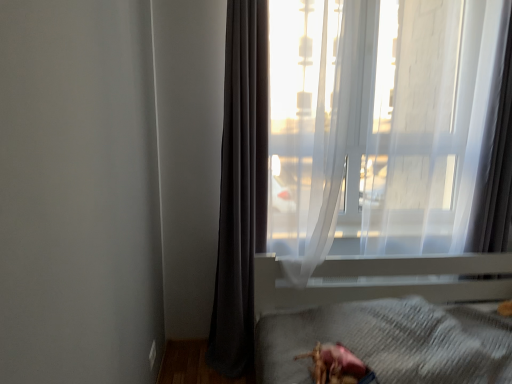
Question: Is white plastic bed frame at lower right far away from transparent fabric at upper right?

Choices:
 (A) no
 (B) yes

Answer: (A)

Question: Does white plastic bed frame at lower right have a larger size compared to transparent fabric at upper right?

Choices:
 (A) yes
 (B) no

Answer: (A)

Question: Is white plastic bed frame at lower right thinner than transparent fabric at upper right?

Choices:
 (A) yes
 (B) no

Answer: (B)

Question: From a real-world perspective, is white plastic bed frame at lower right positioned under transparent fabric at upper right based on gravity?

Choices:
 (A) yes
 (B) no

Answer: (A)

Question: From the image's perspective, is white plastic bed frame at lower right above transparent fabric at upper right?

Choices:
 (A) yes
 (B) no

Answer: (B)

Question: Is white plastic bed frame at lower right placed right next to transparent fabric at upper right?

Choices:
 (A) yes
 (B) no

Answer: (B)

Question: From the image's perspective, is white plastic bed frame at lower right above shiny pink toy at lower center?

Choices:
 (A) yes
 (B) no

Answer: (B)

Question: Can you confirm if white plastic bed frame at lower right is shorter than shiny pink toy at lower center?

Choices:
 (A) no
 (B) yes

Answer: (A)

Question: Is white plastic bed frame at lower right outside shiny pink toy at lower center?

Choices:
 (A) yes
 (B) no

Answer: (A)

Question: Can you confirm if white plastic bed frame at lower right is wider than shiny pink toy at lower center?

Choices:
 (A) no
 (B) yes

Answer: (B)

Question: Is white plastic bed frame at lower right bigger than shiny pink toy at lower center?

Choices:
 (A) yes
 (B) no

Answer: (A)

Question: From a real-world perspective, is white plastic bed frame at lower right located higher than shiny pink toy at lower center?

Choices:
 (A) yes
 (B) no

Answer: (B)

Question: From a real-world perspective, is shiny pink toy at lower center over white plastic bed frame at lower right?

Choices:
 (A) yes
 (B) no

Answer: (A)